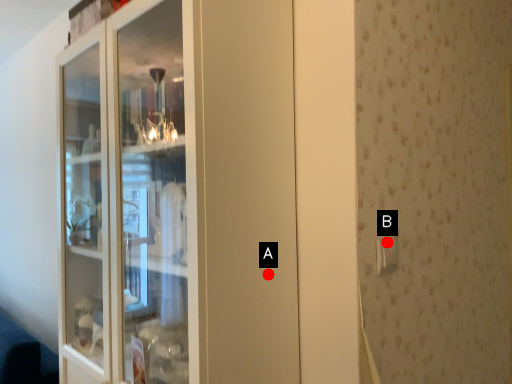
Question: Two points are circled on the image, labeled by A and B beside each circle. Among these points, which one is farthest from the camera?

Choices:
 (A) A is further
 (B) B is further

Answer: (B)